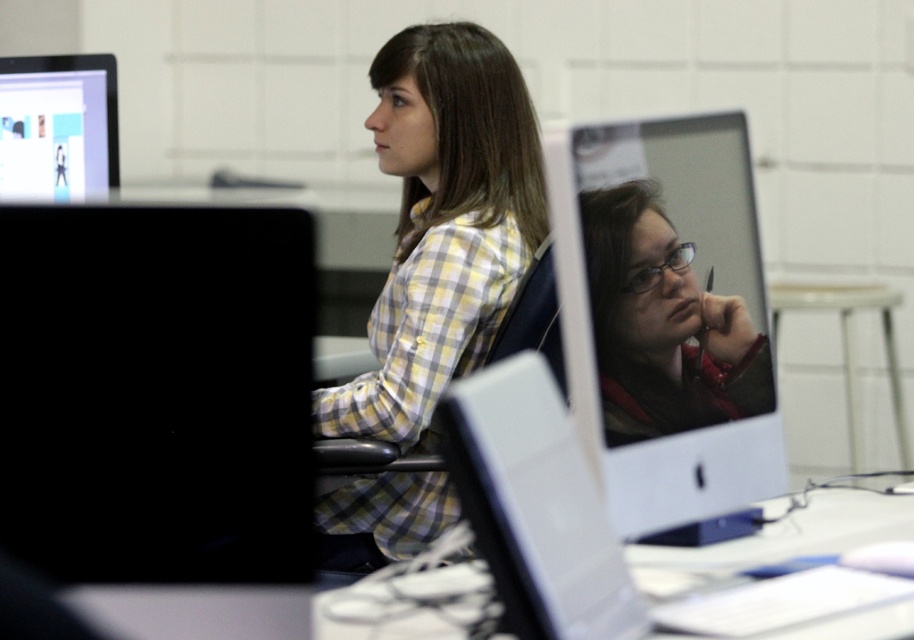
You are a student trying to set up your laptop on the white glossy table at center. However, you notice the matte black monitor at center is in the way. Can you place your laptop on the table without moving the monitor?

The white glossy table at center is positioned under the matte black monitor at center, meaning the monitor is above the table. Since the monitor is above, you can place your laptop on the table underneath without moving it.

You are a student trying to locate your assigned computer in a classroom. You see two monitors, the black matte monitor at left and the matte black monitor at upper left. According to the seating arrangement, which monitor is to the right of the other?

The black matte monitor at left is positioned on the right side of the matte black monitor at upper left, so it is to the right of the matte black monitor at upper left.

You are a person who needs to reach the matte black monitor at upper left from your current position near the yellow plaid shirt at center. Can you comfortably reach it without moving your chair?

The yellow plaid shirt at center is 27.93 inches away from the matte black monitor at upper left. Since 27.93 inches is approximately 2.33 feet, which is within typical comfortable reaching distance for most people, you can likely reach the matte black monitor at upper left without moving your chair.